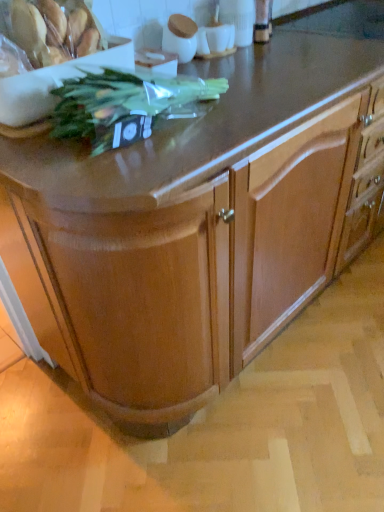
This screenshot has height=512, width=384. I want to click on spots to the right of green leafy plant at upper left, so click(248, 119).